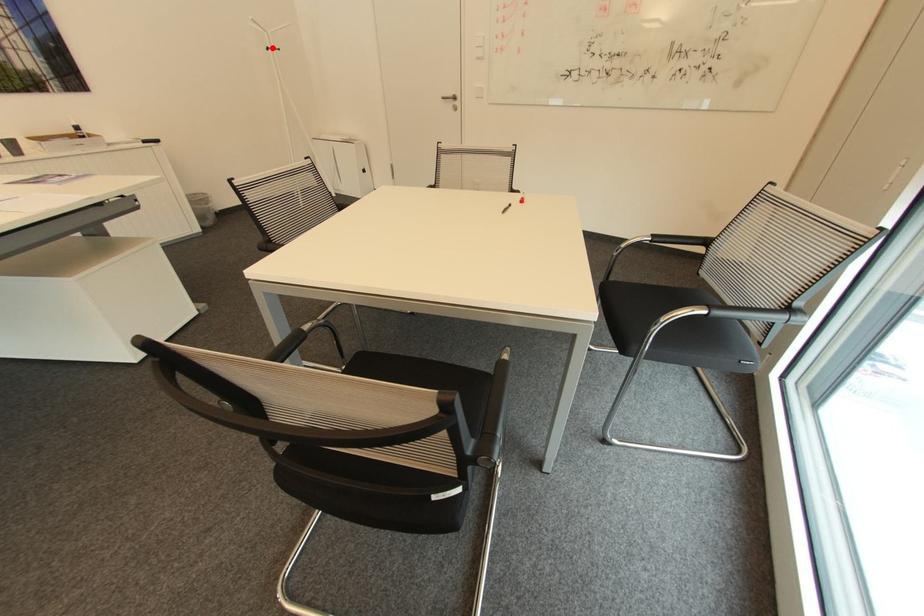
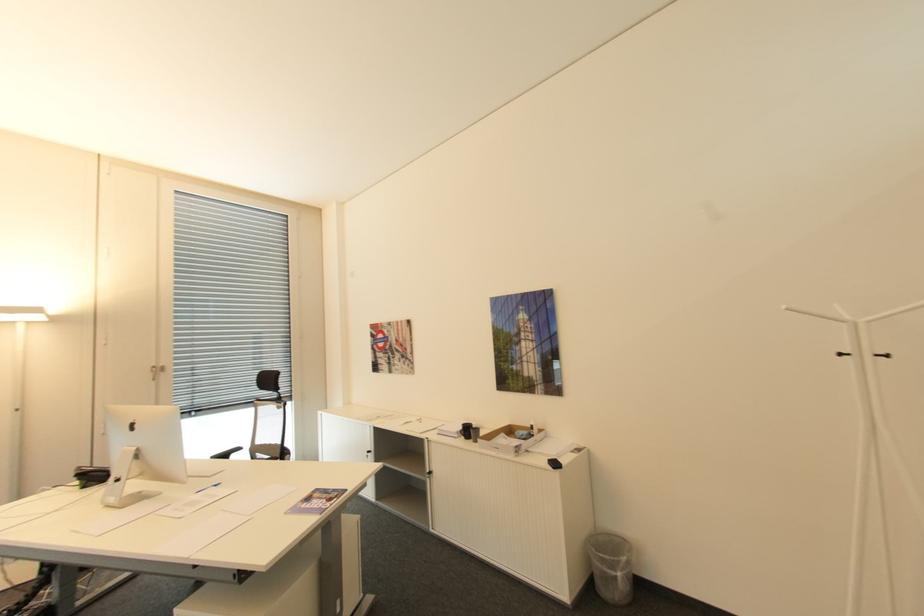
Find the pixel in the second image that matches the highlighted location in the first image.

(846, 355)